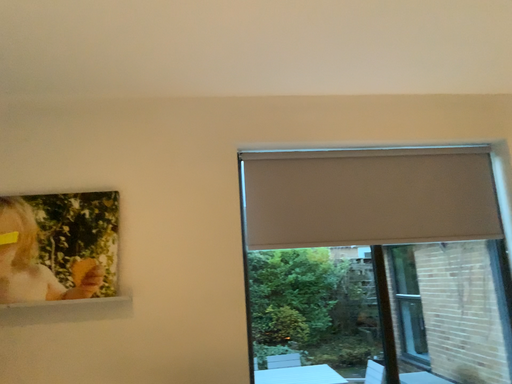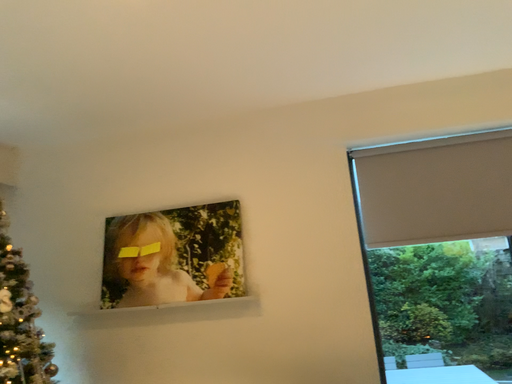
Question: How did the camera likely rotate when shooting the video?

Choices:
 (A) rotated left
 (B) rotated right

Answer: (A)